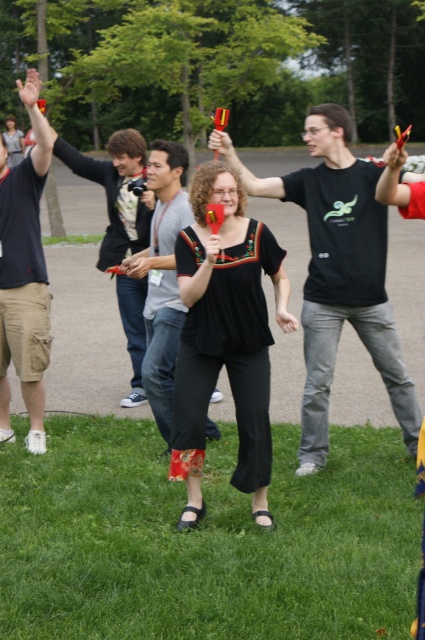
Question: Which object appears closest to the camera in this image?

Choices:
 (A) black cotton t-shirt at center
 (B) matte gray shirt at center

Answer: (A)

Question: Does matte khaki shorts at left have a lesser width compared to matte gray shirt at center?

Choices:
 (A) yes
 (B) no

Answer: (A)

Question: Is matte khaki shorts at left in front of matte gray shirt at center?

Choices:
 (A) no
 (B) yes

Answer: (A)

Question: Which of the following is the farthest from the observer?

Choices:
 (A) matte gray shirt at center
 (B) matte khaki shorts at left
 (C) black cotton t-shirt at center

Answer: (B)

Question: Considering the real-world distances, which object is farthest from the black cotton t-shirt at center?

Choices:
 (A) khaki cargo shorts at left
 (B) matte khaki shorts at left

Answer: (B)

Question: Is green grass at lower center to the right of matte khaki shorts at left from the viewer's perspective?

Choices:
 (A) no
 (B) yes

Answer: (B)